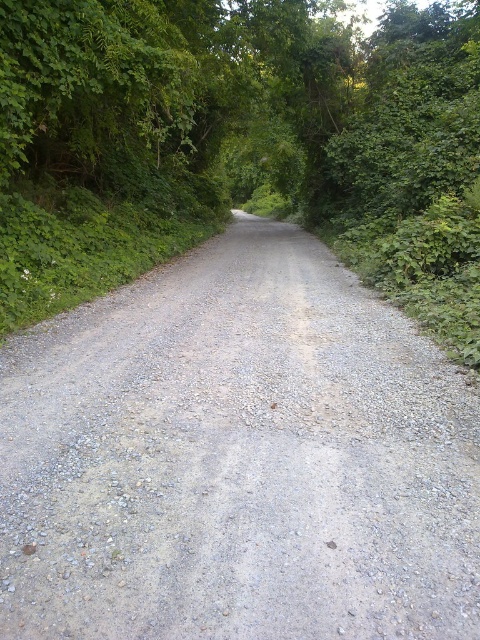
Question: Where is gray gravel road at center located in relation to green leafy forest at center in the image?

Choices:
 (A) left
 (B) right

Answer: (A)

Question: Among these points, which one is nearest to the camera?

Choices:
 (A) (277, 275)
 (B) (20, 246)

Answer: (B)

Question: Which point is closer to the camera?

Choices:
 (A) (319, 474)
 (B) (52, 196)

Answer: (A)

Question: Where is gray gravel road at center located in relation to green leafy forest at center in the image?

Choices:
 (A) right
 (B) left

Answer: (B)

Question: Is gray gravel road at center smaller than green leafy forest at center?

Choices:
 (A) yes
 (B) no

Answer: (A)